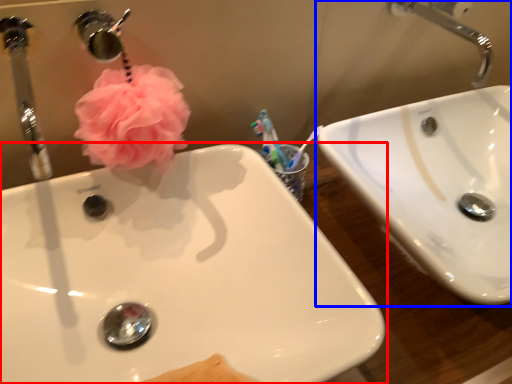
Question: Among these objects, which one is nearest to the camera, sink (highlighted by a red box) or sink (highlighted by a blue box)?

Choices:
 (A) sink
 (B) sink

Answer: (A)